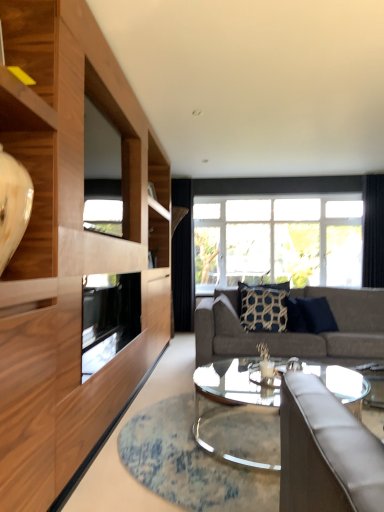
Question: From a real-world perspective, is gray fabric couch at center beneath transparent glass window screen at upper left?

Choices:
 (A) yes
 (B) no

Answer: (A)

Question: Does gray fabric couch at center appear on the left side of transparent glass window screen at upper left?

Choices:
 (A) yes
 (B) no

Answer: (B)

Question: Are gray fabric couch at center and transparent glass window screen at upper left far apart?

Choices:
 (A) yes
 (B) no

Answer: (A)

Question: Does gray fabric couch at center have a larger size compared to transparent glass window screen at upper left?

Choices:
 (A) yes
 (B) no

Answer: (A)

Question: From the image's perspective, is gray fabric couch at center over transparent glass window screen at upper left?

Choices:
 (A) no
 (B) yes

Answer: (A)

Question: From a real-world perspective, is gray fabric couch at center over transparent glass window screen at upper left?

Choices:
 (A) yes
 (B) no

Answer: (B)

Question: Considering the relative sizes of transparent glass window screen at upper left and dark blue textured pillow at center, acting as the first pillow starting from the right, in the image provided, is transparent glass window screen at upper left bigger than dark blue textured pillow at center, acting as the first pillow starting from the right,?

Choices:
 (A) yes
 (B) no

Answer: (A)

Question: Is transparent glass window screen at upper left thinner than dark blue textured pillow at center, acting as the first pillow starting from the right?

Choices:
 (A) yes
 (B) no

Answer: (A)

Question: From a real-world perspective, is transparent glass window screen at upper left on top of dark blue textured pillow at center, acting as the first pillow starting from the right?

Choices:
 (A) no
 (B) yes

Answer: (B)

Question: Is the position of transparent glass window screen at upper left less distant than that of dark blue textured pillow at center, positioned as the 2th pillow in left-to-right order?

Choices:
 (A) yes
 (B) no

Answer: (A)

Question: Can you confirm if transparent glass window screen at upper left is positioned to the right of dark blue textured pillow at center, acting as the first pillow starting from the right?

Choices:
 (A) no
 (B) yes

Answer: (A)

Question: Is transparent glass window screen at upper left touching dark blue textured pillow at center, acting as the first pillow starting from the right?

Choices:
 (A) yes
 (B) no

Answer: (B)

Question: Is dark blue textured pillow at center, positioned as the 2th pillow in left-to-right order, positioned beyond the bounds of clear glass coffee table at center?

Choices:
 (A) yes
 (B) no

Answer: (A)